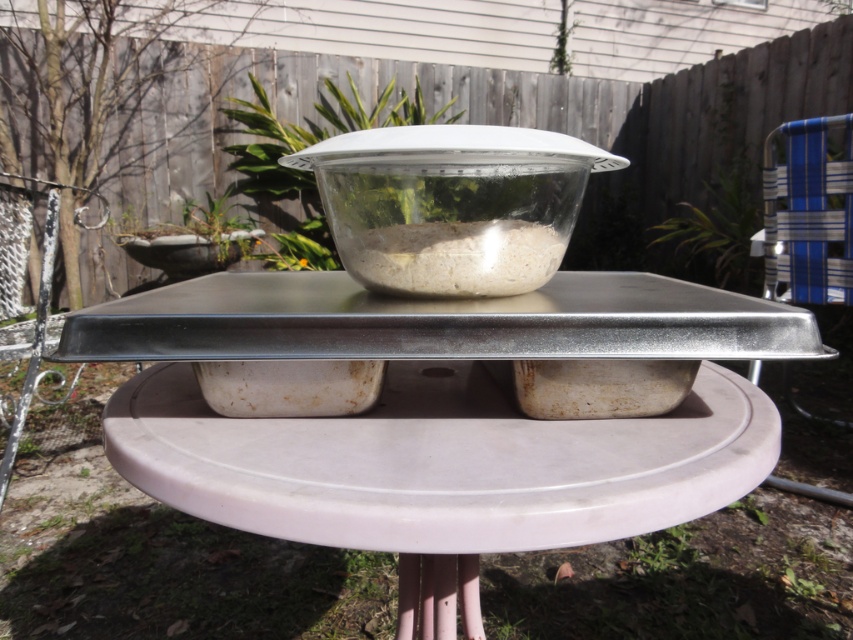
You are setting up a picnic in the backyard and have a metallic gray tray at center and a translucent glass bowl at center on the table. Which one should you use to serve a large platter of sandwiches?

The metallic gray tray at center is bigger than the translucent glass bowl at center, so you should use the metallic gray tray at center to serve the large platter of sandwiches.

You are organizing a picnic and need to know which item is placed below the other on the table. Which is lower in position between the metallic gray tray at center and the translucent glass bowl at center?

The metallic gray tray at center is positioned under the translucent glass bowl at center, so it is lower in position.

You are setting up a picnic and need to place a bottle of water between the metallic gray tray at center and the translucent glass bowl at center. According to the scene, which object should the bottle be placed to the right of?

The bottle should be placed to the right of the metallic gray tray at center because the metallic gray tray at center is to the left of the translucent glass bowl at center.